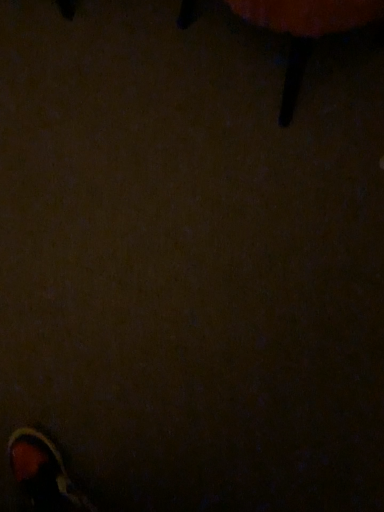
The width and height of the screenshot is (384, 512). What do you see at coordinates (305, 31) in the screenshot? I see `wooden swivel chair at upper center` at bounding box center [305, 31].

Locate an element on the screen. The image size is (384, 512). wooden swivel chair at upper center is located at coordinates (305, 31).

The width and height of the screenshot is (384, 512). Find the location of `wooden swivel chair at upper center`. wooden swivel chair at upper center is located at coordinates pyautogui.click(x=305, y=31).